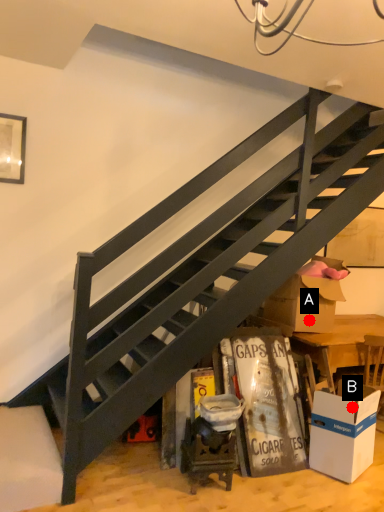
Question: Two points are circled on the image, labeled by A and B beside each circle. Which point appears farthest from the camera in this image?

Choices:
 (A) A is further
 (B) B is further

Answer: (A)